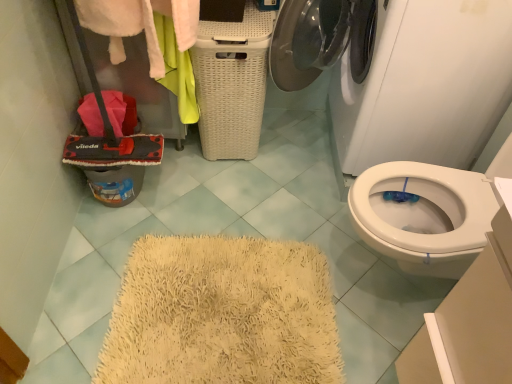
Question: Is white fluffy towel at upper left with white glossy washing machine at upper center?

Choices:
 (A) yes
 (B) no

Answer: (B)

Question: Considering the relative sizes of white fluffy towel at upper left and white glossy washing machine at upper center in the image provided, is white fluffy towel at upper left wider than white glossy washing machine at upper center?

Choices:
 (A) yes
 (B) no

Answer: (B)

Question: Could you tell me if white fluffy towel at upper left is turned towards white glossy washing machine at upper center?

Choices:
 (A) no
 (B) yes

Answer: (A)

Question: Can we say white fluffy towel at upper left lies outside white glossy washing machine at upper center?

Choices:
 (A) no
 (B) yes

Answer: (B)

Question: Is white fluffy towel at upper left shorter than white glossy washing machine at upper center?

Choices:
 (A) yes
 (B) no

Answer: (A)

Question: In the image, is white wicker basket at center on the left side or the right side of white glossy washing machine at upper center?

Choices:
 (A) left
 (B) right

Answer: (A)

Question: From a real-world perspective, is white wicker basket at center above or below white glossy washing machine at upper center?

Choices:
 (A) below
 (B) above

Answer: (A)

Question: Is point (244, 72) closer or farther from the camera than point (387, 21)?

Choices:
 (A) farther
 (B) closer

Answer: (A)

Question: Would you say white wicker basket at center is inside or outside white glossy washing machine at upper center?

Choices:
 (A) outside
 (B) inside

Answer: (A)

Question: Choose the correct answer: Is white glossy washing machine at upper center inside white fluffy towel at upper left or outside it?

Choices:
 (A) inside
 (B) outside

Answer: (B)

Question: Is white glossy washing machine at upper center to the left or to the right of white fluffy towel at upper left in the image?

Choices:
 (A) left
 (B) right

Answer: (B)

Question: Is point (419, 26) closer or farther from the camera than point (158, 8)?

Choices:
 (A) closer
 (B) farther

Answer: (A)

Question: Looking at the image, does white glossy washing machine at upper center seem bigger or smaller compared to white fluffy towel at upper left?

Choices:
 (A) big
 (B) small

Answer: (A)

Question: Is white wicker basket at center inside or outside of white fluffy towel at upper left?

Choices:
 (A) inside
 (B) outside

Answer: (B)

Question: Relative to white fluffy towel at upper left, is white wicker basket at center in front or behind?

Choices:
 (A) behind
 (B) front

Answer: (A)